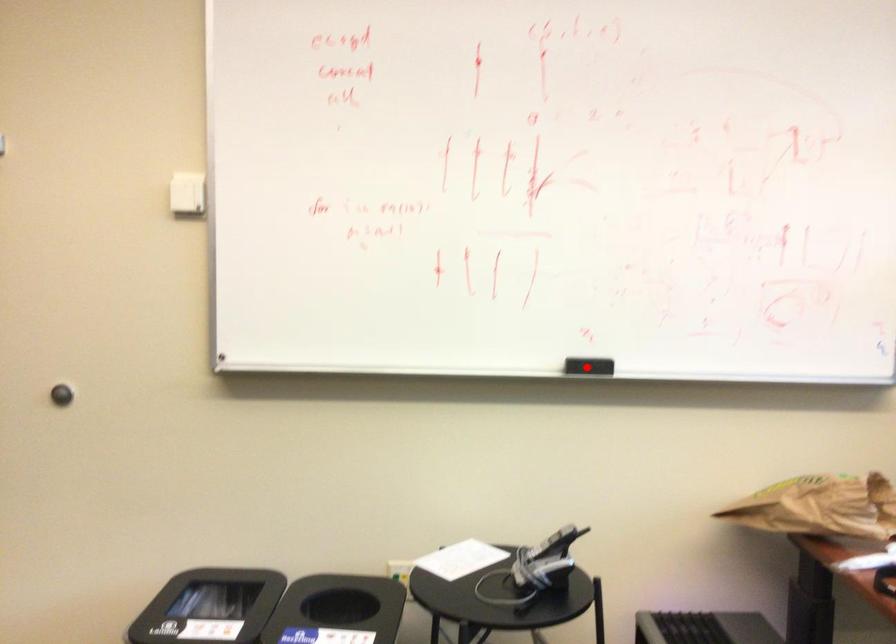
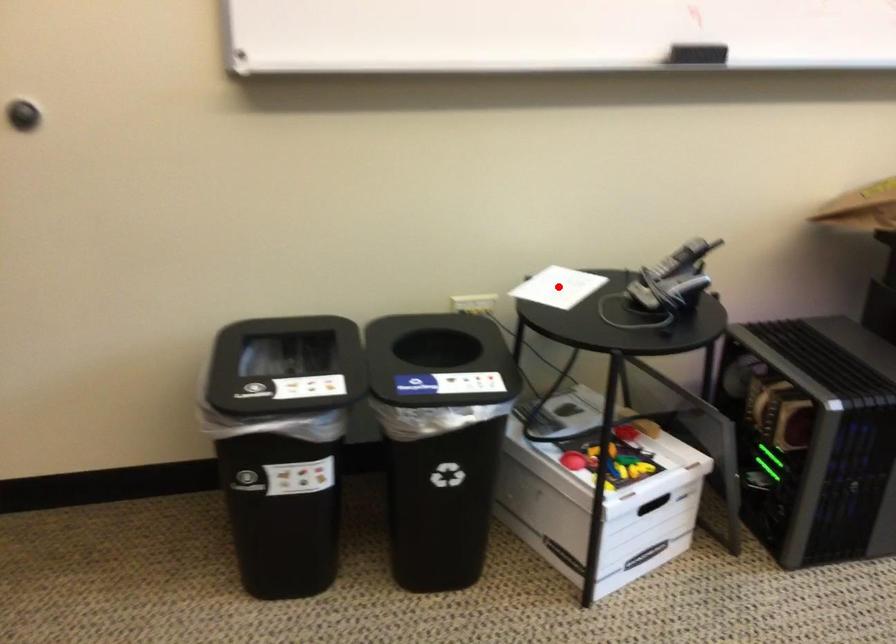
I am providing you with two images of the same scene from different viewpoints. A red point is marked on the first image and another point is marked on the second image. Is the marked point in image1 the same physical position as the marked point in image2?

No